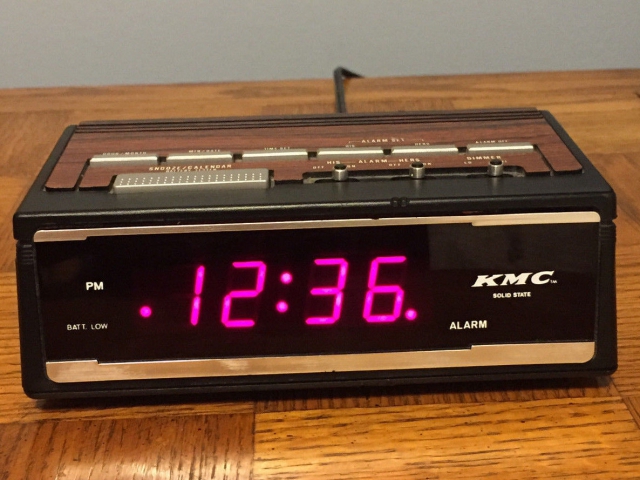
Locate an element on the screen. gray wall is located at coordinates (166, 59).